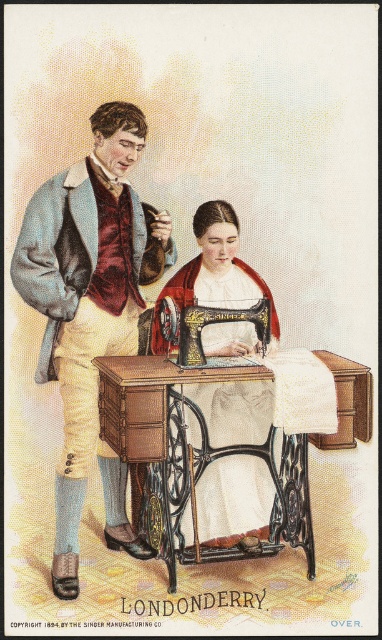
You are a tailor who needs to store the light blue wool coat at left and the black wrought iron sewing machine at center in a closet. The closet has a narrow shelf that can only hold items thinner than 10 cm. Which item can be placed on the shelf?

The light blue wool coat at left is thinner than the black wrought iron sewing machine at center. Since the coat is thinner, it can be placed on the shelf if its thickness is under 10 cm. However, the sewing machine may be too thick to fit on the narrow shelf.

You are a furniture mover who needs to move both the black wrought iron sewing machine at center and the black cast iron sewing machine at center into a storage room. The storage room has a narrow doorway that is 14 inches wide. Can you move both machines through the doorway one at a time without tilting them?

The distance between the black wrought iron sewing machine at center and the black cast iron sewing machine at center is 13.79 inches. Since the doorway is 14 inches wide, both machines can be moved through the doorway one at a time as their width is less than the doorway width.

You are standing at the point marked as point (116,273). The Singer sewing machine is 3.25 meters away from you. If you want to walk directly to the Singer sewing machine, which direction should you head towards?

Since the Singer sewing machine is 3.25 meters away from point (116,273), you should head towards the Singer sewing machine in the direction it is located relative to your current position.